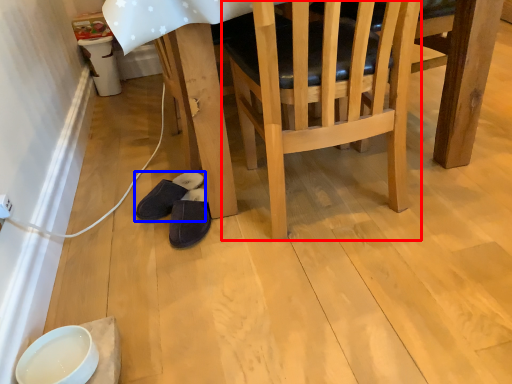
Question: Which object appears closest to the camera in this image, chair (highlighted by a red box) or footwear (highlighted by a blue box)?

Choices:
 (A) chair
 (B) footwear

Answer: (A)